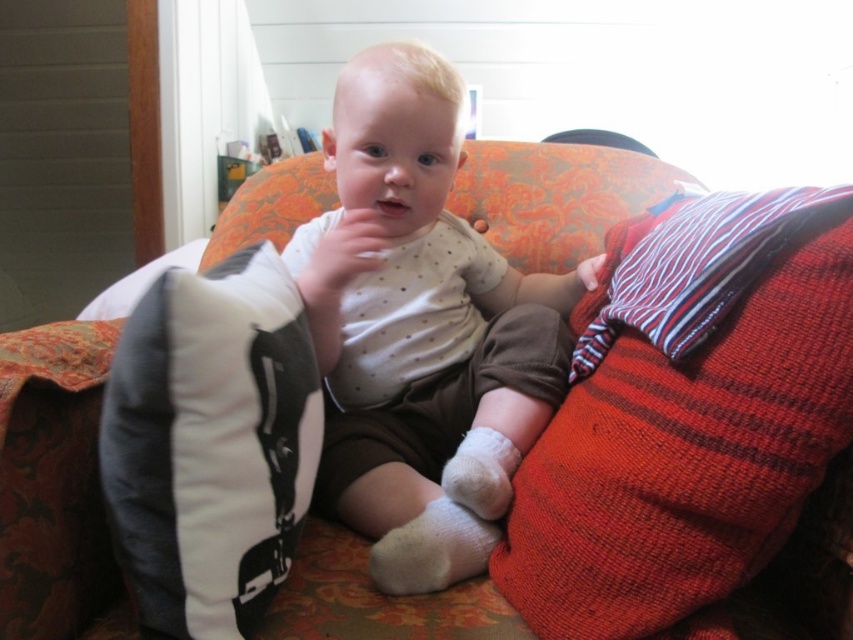
Can you confirm if red knitted blanket at right is shorter than white fabric pillow at left?

No, red knitted blanket at right is not shorter than white fabric pillow at left.

Between point (561, 419) and point (280, 337), which one is positioned in front?

Point (280, 337) is more forward.

Is point (821, 211) farther from viewer compared to point (154, 548)?

Yes, point (821, 211) is behind point (154, 548).

Locate an element on the screen. This screenshot has width=853, height=640. red knitted blanket at right is located at coordinates (688, 417).

Who is shorter, red knitted blanket at right or white soft baby at center?

red knitted blanket at right

This screenshot has height=640, width=853. Identify the location of red knitted blanket at right. (688, 417).

Who is shorter, white soft baby at center or white fabric pillow at left?

Standing shorter between the two is white fabric pillow at left.

What do you see at coordinates (421, 330) in the screenshot?
I see `white soft baby at center` at bounding box center [421, 330].

Find the location of a particular element. This screenshot has height=640, width=853. white soft baby at center is located at coordinates (421, 330).